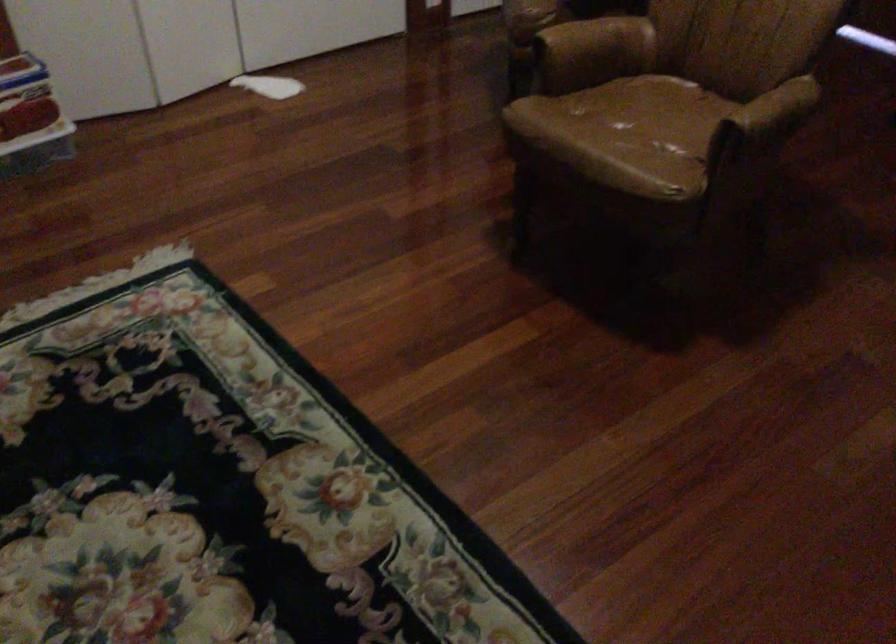
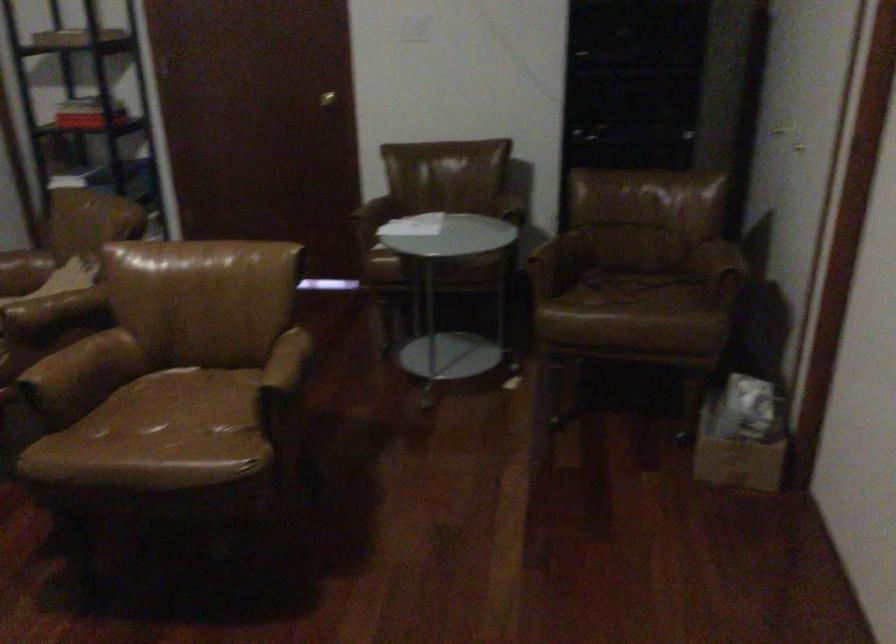
Question: The camera is either moving clockwise (left) or counter-clockwise (right) around the object. The first image is from the beginning of the video and the second image is from the end. Is the camera moving left or right when shooting the video?

Choices:
 (A) Left
 (B) Right

Answer: (A)